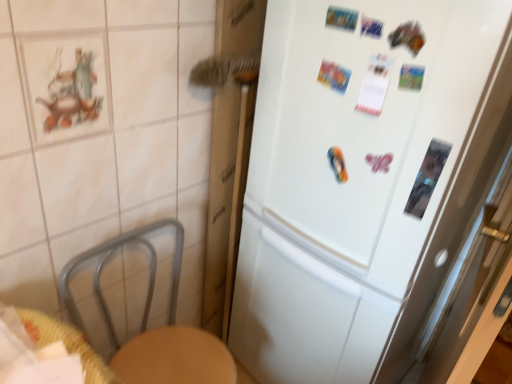
Question: Should I look upward or downward to see white matte refrigerator at center?

Choices:
 (A) down
 (B) up

Answer: (A)

Question: Is white matte refrigerator at center positioned in front of transparent glass screen door at right?

Choices:
 (A) no
 (B) yes

Answer: (A)

Question: Is white matte refrigerator at center next to transparent glass screen door at right and touching it?

Choices:
 (A) no
 (B) yes

Answer: (A)

Question: From a real-world perspective, is white matte refrigerator at center on top of transparent glass screen door at right?

Choices:
 (A) yes
 (B) no

Answer: (A)

Question: Does white matte refrigerator at center have a smaller size compared to transparent glass screen door at right?

Choices:
 (A) no
 (B) yes

Answer: (A)

Question: Does white matte refrigerator at center have a larger size compared to transparent glass screen door at right?

Choices:
 (A) yes
 (B) no

Answer: (A)

Question: Are white matte refrigerator at center and transparent glass screen door at right far apart?

Choices:
 (A) yes
 (B) no

Answer: (B)

Question: Considering the relative sizes of transparent glass screen door at right and white matte refrigerator at center in the image provided, is transparent glass screen door at right smaller than white matte refrigerator at center?

Choices:
 (A) yes
 (B) no

Answer: (A)

Question: From the image's perspective, would you say transparent glass screen door at right is positioned over white matte refrigerator at center?

Choices:
 (A) no
 (B) yes

Answer: (A)

Question: Would you say transparent glass screen door at right contains white matte refrigerator at center?

Choices:
 (A) no
 (B) yes

Answer: (A)

Question: Does transparent glass screen door at right have a greater height compared to white matte refrigerator at center?

Choices:
 (A) no
 (B) yes

Answer: (A)

Question: Is transparent glass screen door at right far away from white matte refrigerator at center?

Choices:
 (A) yes
 (B) no

Answer: (B)

Question: Is transparent glass screen door at right oriented towards white matte refrigerator at center?

Choices:
 (A) no
 (B) yes

Answer: (B)

Question: Considering the relative sizes of white matte refrigerator at center and woven wood table at lower left in the image provided, is white matte refrigerator at center thinner than woven wood table at lower left?

Choices:
 (A) yes
 (B) no

Answer: (B)